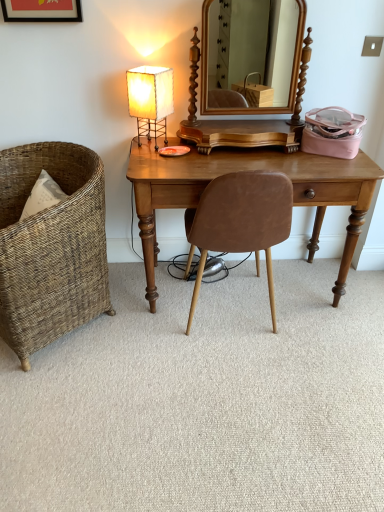
Locate an element on the screen. empty space that is in between brown leather chair at center, placed as the second chair when sorted from left to right, and light brown wood desk at center is located at coordinates (265, 325).